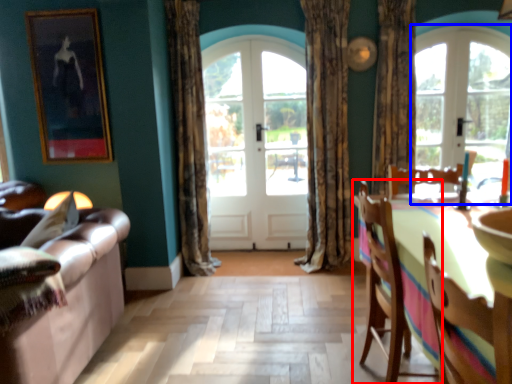
Question: Which point is closer to the camera, chair (highlighted by a red box) or window (highlighted by a blue box)?

Choices:
 (A) chair
 (B) window

Answer: (A)